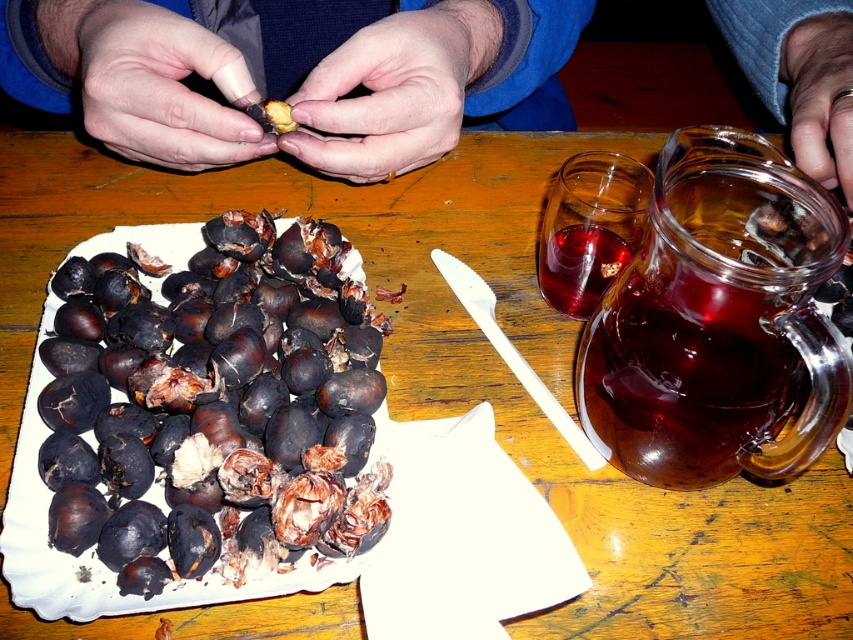
This screenshot has width=853, height=640. What do you see at coordinates (215, 408) in the screenshot?
I see `black matte chestnuts at lower left` at bounding box center [215, 408].

Locate an element on the screen. This screenshot has width=853, height=640. black matte chestnuts at lower left is located at coordinates (215, 408).

Who is positioned more to the right, black matte chestnuts at lower left or transparent glass jar at upper right?

From the viewer's perspective, transparent glass jar at upper right appears more on the right side.

Does black matte chestnuts at lower left appear over transparent glass jar at upper right?

Actually, black matte chestnuts at lower left is below transparent glass jar at upper right.

Does point (202, 554) come in front of point (674, 346)?

Yes, it is in front of point (674, 346).

You are a GUI agent. You are given a task and a screenshot of the screen. Output one action in this format:
    pyautogui.click(x=<x>, y=<y>)
    Task: Click on the black matte chestnuts at lower left
    The image size is (853, 640).
    Given the screenshot: What is the action you would take?
    pyautogui.click(x=215, y=408)

Does point (548, 298) come behind point (271, 120)?

Yes, point (548, 298) is farther from viewer.

Who is more distant from viewer, (543, 269) or (279, 109)?

The point (543, 269) is behind.

Identify the location of transparent glass at upper right. (590, 227).